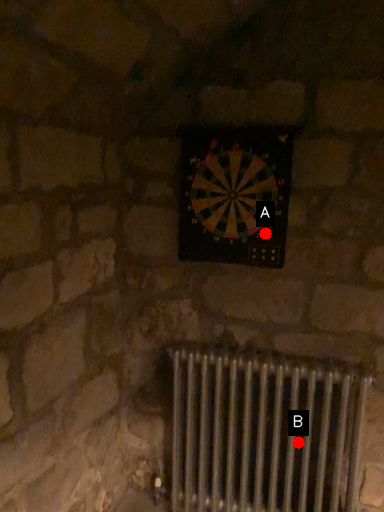
Question: Two points are circled on the image, labeled by A and B beside each circle. Among these points, which one is nearest to the camera?

Choices:
 (A) A is closer
 (B) B is closer

Answer: (A)